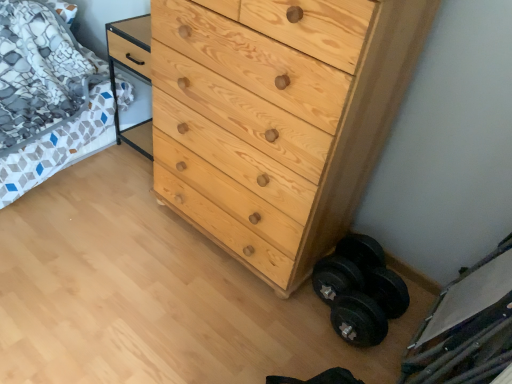
Where is `vacant area that lies in front of natural wood chest of drawers at center`? The width and height of the screenshot is (512, 384). vacant area that lies in front of natural wood chest of drawers at center is located at coordinates (192, 313).